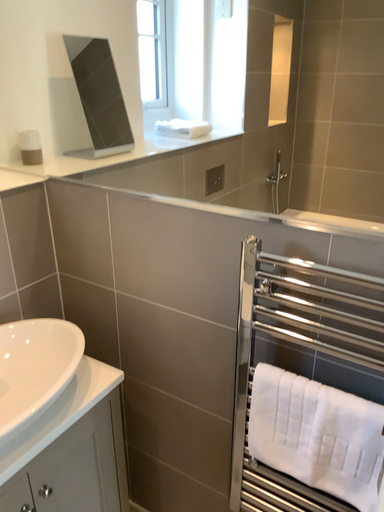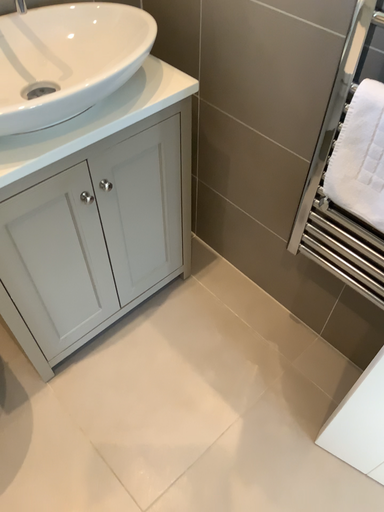
Question: How did the camera likely rotate when shooting the video?

Choices:
 (A) rotated downward
 (B) rotated upward

Answer: (A)